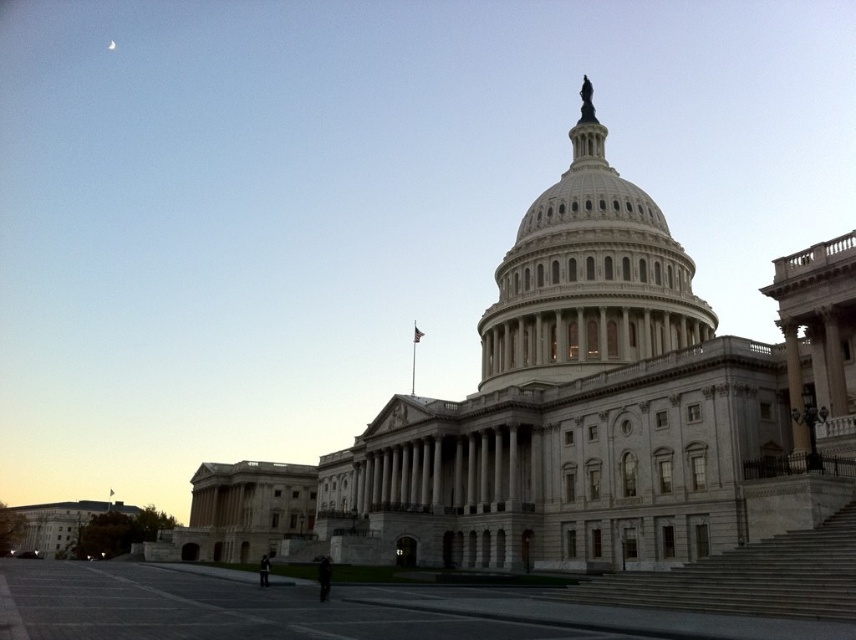
Question: Does white marble dome at center lie in front of gray stone stairs at lower right?

Choices:
 (A) yes
 (B) no

Answer: (B)

Question: Does white marble dome at center appear on the left side of gray stone stairs at lower right?

Choices:
 (A) yes
 (B) no

Answer: (A)

Question: Is white marble dome at center thinner than gray stone stairs at lower right?

Choices:
 (A) no
 (B) yes

Answer: (A)

Question: Which point appears closest to the camera in this image?

Choices:
 (A) (827, 614)
 (B) (652, 204)

Answer: (A)

Question: Which point is farther from the camera taking this photo?

Choices:
 (A) (580, 589)
 (B) (640, 324)

Answer: (B)

Question: Which point is farther to the camera?

Choices:
 (A) (545, 221)
 (B) (747, 557)

Answer: (A)